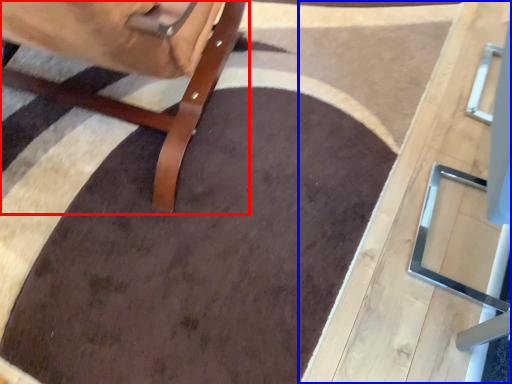
Question: Which point is further to the camera, furniture (highlighted by a red box) or table (highlighted by a blue box)?

Choices:
 (A) furniture
 (B) table

Answer: (A)